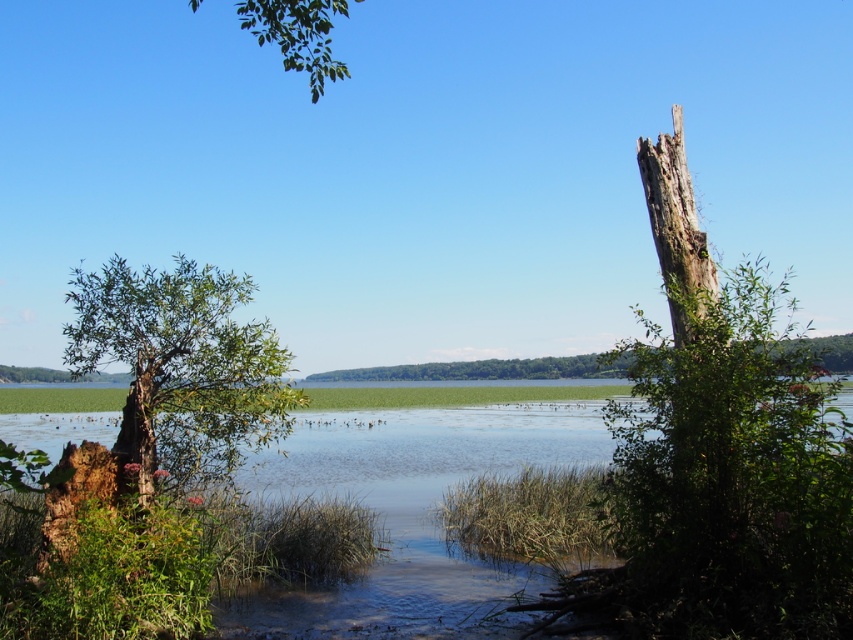
In the scene shown: You are standing at the edge of the scene and want to cross to the other side. The green grassy river at center is in your path. Can you safely step over it without getting your shoes wet?

The green grassy river at center is 6.09 meters away from you, so you can safely step over it without getting your shoes wet.

You are standing at the edge of the green grassy river at center and want to reach the green leafy branch at upper center. Which direction should you move to get closer to the branch?

The green leafy branch at upper center is taller than the green grassy river at center, so you should move forward towards the branch to get closer.

You are standing in the middle of the scene and want to look at the green leafy tree at left and the green leafy branch at upper center. Which object is closer to you?

The green leafy tree at left is positioned under the green leafy branch at upper center, so the green leafy branch at upper center is closer to you.